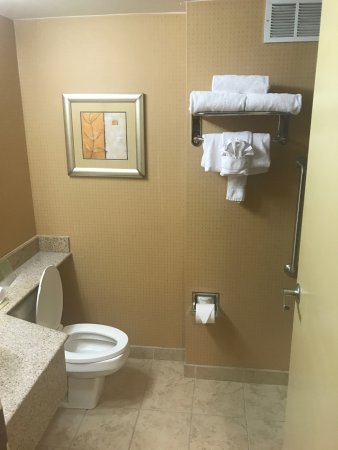
Image resolution: width=338 pixels, height=450 pixels. In order to click on toilet paper holder in this screenshot , I will do `click(194, 303)`, `click(217, 300)`.